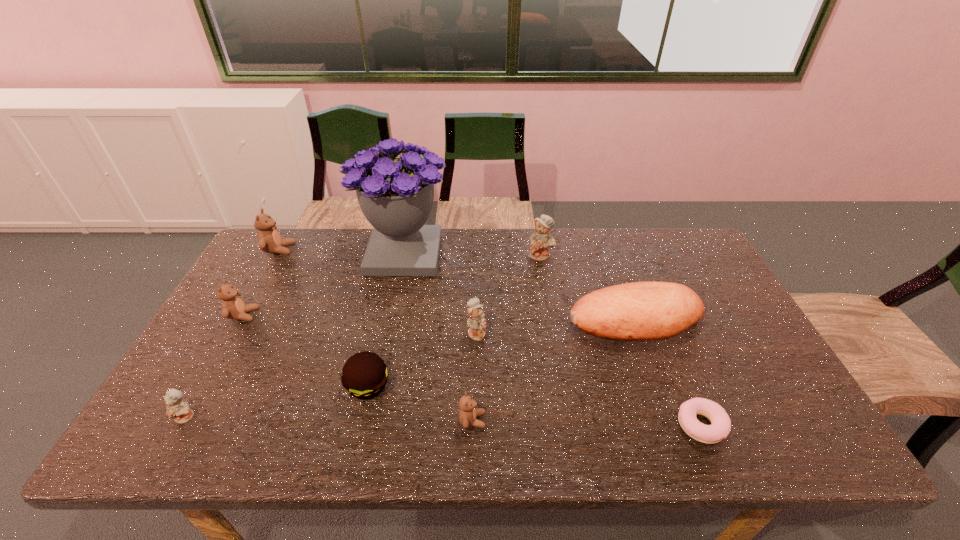
Select which blue teddy bear is the third closest to the second nearest brown teddy bear. Please provide its 2D coordinates. Your answer should be formatted as a tuple, i.e. [(x, y)], where the tuple contains the x and y coordinates of a point satisfying the conditions above.

[(541, 240)]

At what (x,y) coordinates should I click in order to perform the action: click on blank area in the image that satisfies the following two spatial constraints: 1. on the front-facing side of the farthest blue teddy bear; 2. on the front-facing side of the second farthest blue teddy bear. Please return your answer as a coordinate pair (x, y). Looking at the image, I should click on (554, 333).

You are a GUI agent. You are given a task and a screenshot of the screen. Output one action in this format:
    pyautogui.click(x=<x>, y=<y>)
    Task: Click on the vacant region that satisfies the following two spatial constraints: 1. on the front-facing side of the patty; 2. on the left side of the biggest brown teddy bear
    The image size is (960, 540).
    Given the screenshot: What is the action you would take?
    pyautogui.click(x=204, y=386)

Find the location of a particular element. free location that satisfies the following two spatial constraints: 1. on the front-facing side of the tallest object; 2. on the left side of the biggest brown teddy bear is located at coordinates (277, 254).

The height and width of the screenshot is (540, 960). I want to click on free spot that satisfies the following two spatial constraints: 1. on the front-facing side of the biggest brown teddy bear; 2. on the right side of the bread, so click(241, 320).

Locate an element on the screen. The image size is (960, 540). vacant point that satisfies the following two spatial constraints: 1. on the front-facing side of the light bread; 2. on the right side of the rightmost blue teddy bear is located at coordinates (552, 320).